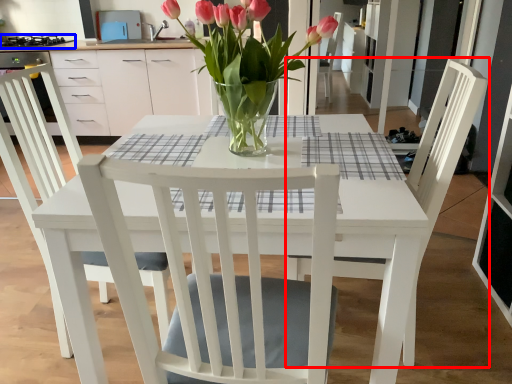
Question: Which point is further to the camera, chair (highlighted by a red box) or appliance (highlighted by a blue box)?

Choices:
 (A) chair
 (B) appliance

Answer: (B)